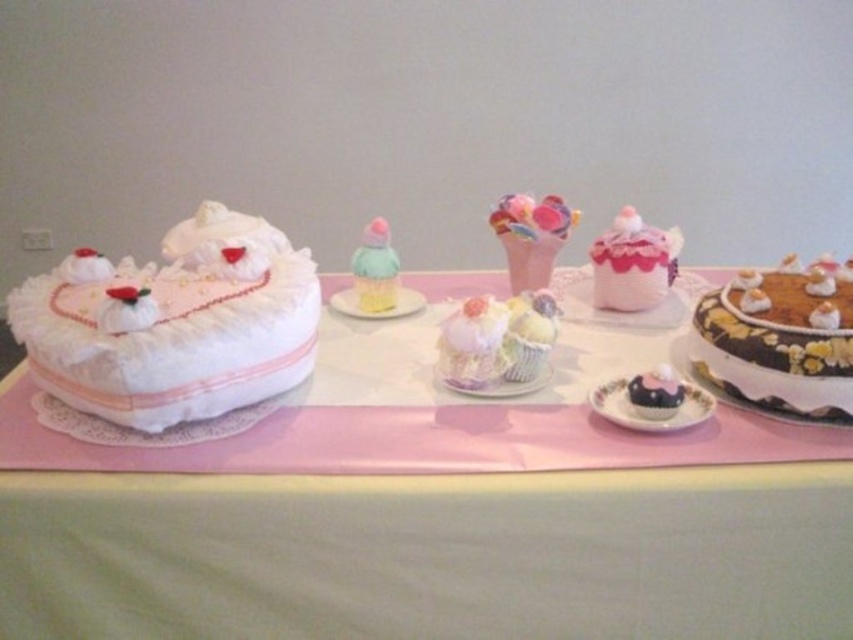
Question: Which point is farther to the camera?

Choices:
 (A) yellow frosted cupcake at center
 (B) pastel felt cupcake at center
 (C) satin white cupcake at center
 (D) chocolate frosted cake at right

Answer: (B)

Question: Which object is positioned closest to the chocolate frosted cupcake at lower right?

Choices:
 (A) white lace cake at left
 (B) chocolate matte cupcake at lower right
 (C) chocolate frosted cake at right

Answer: (B)

Question: From the image, what is the correct spatial relationship of chocolate frosted cake at right in relation to yellow frosted cupcake at center?

Choices:
 (A) above
 (B) below

Answer: (B)

Question: Is pink fabric cupcake at center positioned before chocolate frosted cupcake at lower right?

Choices:
 (A) yes
 (B) no

Answer: (B)

Question: Which of the following is the closest to the observer?

Choices:
 (A) chocolate matte cupcake at lower right
 (B) white lace cake at left
 (C) pastel lace cupcake at center
 (D) pastel fluffy cupcake at center

Answer: (B)

Question: Can you confirm if yellow frosted cupcake at center is positioned to the left of pastel lace cupcake at center?

Choices:
 (A) yes
 (B) no

Answer: (A)